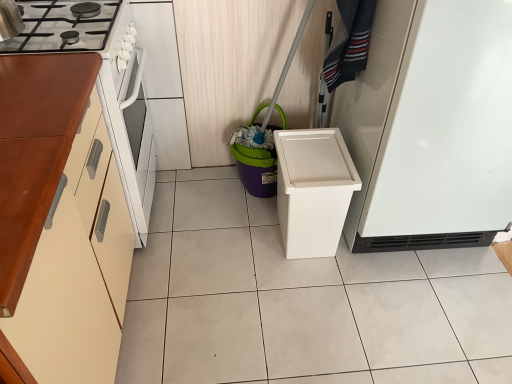
Question: Is wooden cabinet at left inside the boundaries of purple plastic bucket at center, or outside?

Choices:
 (A) inside
 (B) outside

Answer: (B)

Question: Considering the relative positions of wooden cabinet at left and purple plastic bucket at center in the image provided, is wooden cabinet at left to the left or to the right of purple plastic bucket at center?

Choices:
 (A) right
 (B) left

Answer: (B)

Question: Which is farther from the wooden cabinet at left?

Choices:
 (A) white matte refrigerator at right
 (B) denim fabric laundry at upper right
 (C) purple plastic bucket at center

Answer: (A)

Question: Which object is the closest to the wooden cabinet at left?

Choices:
 (A) denim fabric laundry at upper right
 (B) white matte refrigerator at right
 (C) purple plastic bucket at center

Answer: (C)